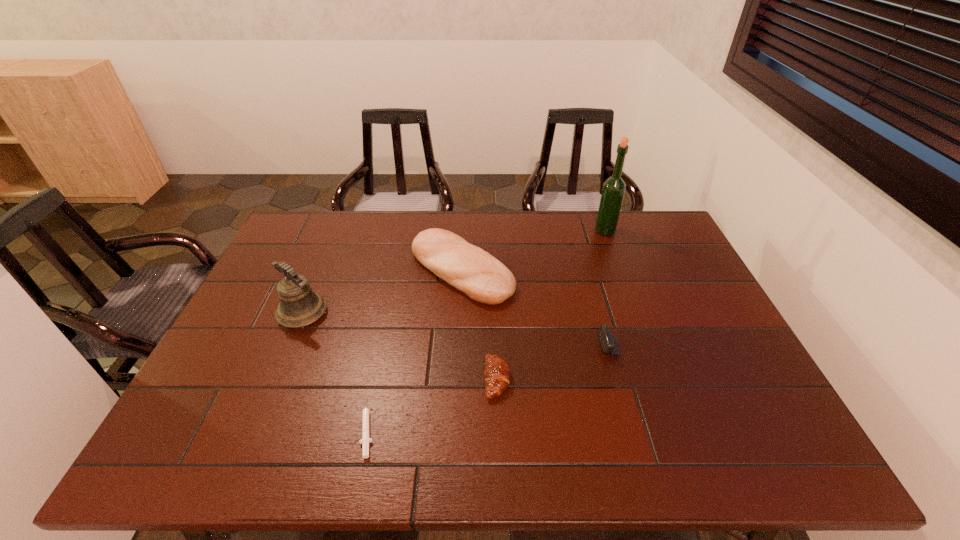
The height and width of the screenshot is (540, 960). I want to click on vacant space located on the right of the leftmost object, so click(460, 313).

Where is `free space located on the right of the third tallest object`? The width and height of the screenshot is (960, 540). free space located on the right of the third tallest object is located at coordinates (593, 271).

Find the location of `free space located on the front-facing side of the fourth tallest object`. free space located on the front-facing side of the fourth tallest object is located at coordinates (x=503, y=345).

This screenshot has width=960, height=540. In order to click on vacant space located 0.370m on the front-facing side of the fourth tallest object in this screenshot , I will do `click(458, 345)`.

Identify the location of vacant space positioned on the front-facing side of the fourth tallest object. The width and height of the screenshot is (960, 540). (503, 345).

Locate an element on the screen. This screenshot has height=540, width=960. free space located on the front of the crescent roll is located at coordinates (500, 460).

At what (x,y) coordinates should I click in order to perform the action: click on vacant area located 0.130m on the back of the shortest object. Please return your answer as a coordinate pair (x, y). Looking at the image, I should click on (383, 354).

The width and height of the screenshot is (960, 540). I want to click on liquor located at the far edge, so click(x=614, y=187).

The width and height of the screenshot is (960, 540). I want to click on bread that is at the far edge, so click(470, 269).

I want to click on object present at the near edge, so click(365, 440).